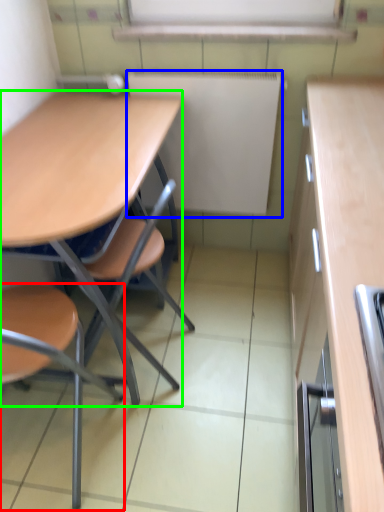
Question: Which object is the closest to the chair (highlighted by a red box)? Choose among these: bulletin board (highlighted by a blue box) or desk (highlighted by a green box).

Choices:
 (A) bulletin board
 (B) desk

Answer: (B)